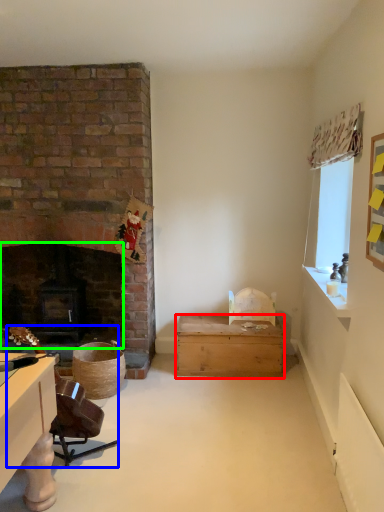
Question: Considering the real-world distances, which object is closest to box (highlighted by a red box)? swivel chair (highlighted by a blue box) or fireplace (highlighted by a green box).

Choices:
 (A) swivel chair
 (B) fireplace

Answer: (B)